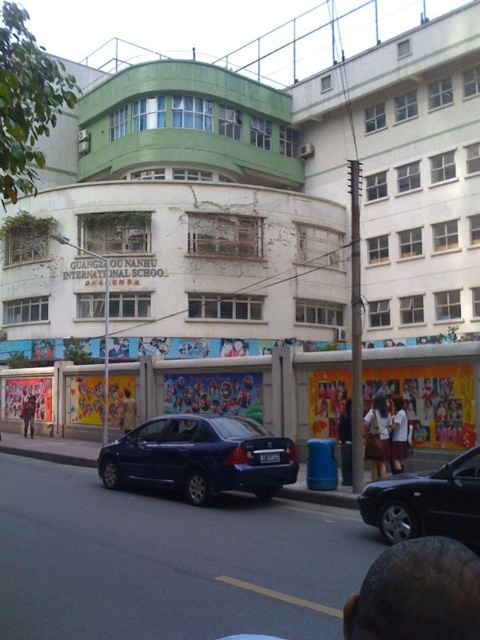
You are a student walking on the street and see a brown fabric bag at center and a white fabric shirt at lower center. Which object is closer to you?

The white fabric shirt at lower center is closer to you since it is positioned at lower center compared to the brown fabric bag at center.